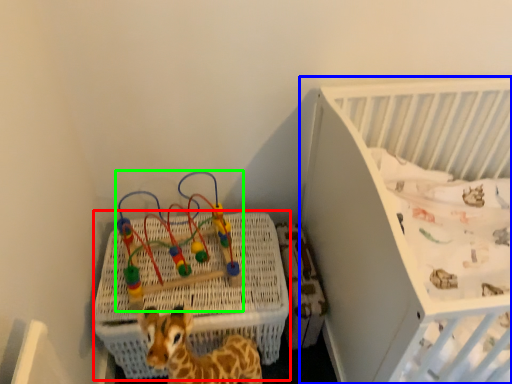
Question: Which object is positioned closest to crate (highlighted by a red box)? Select from infant bed (highlighted by a blue box) and toy (highlighted by a green box).

Choices:
 (A) infant bed
 (B) toy

Answer: (B)